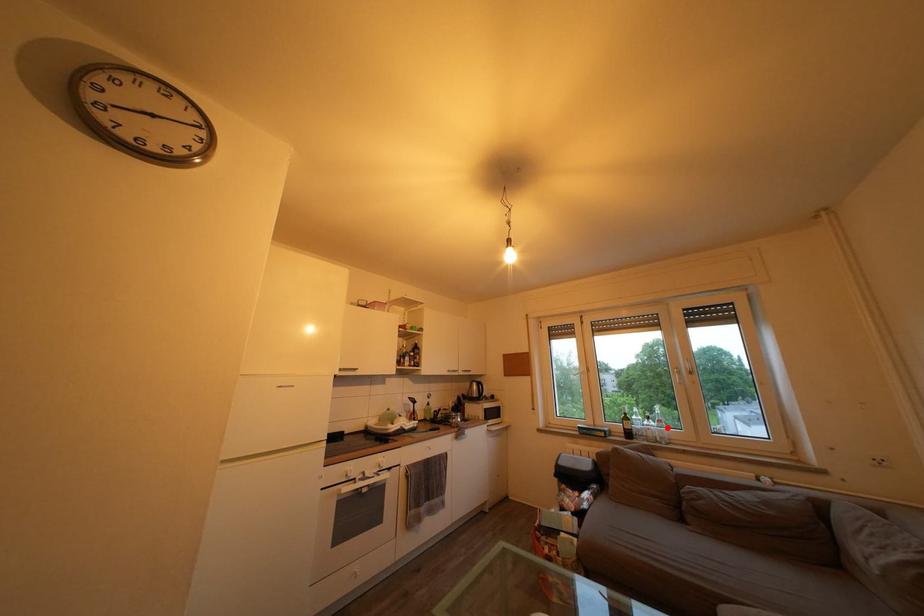
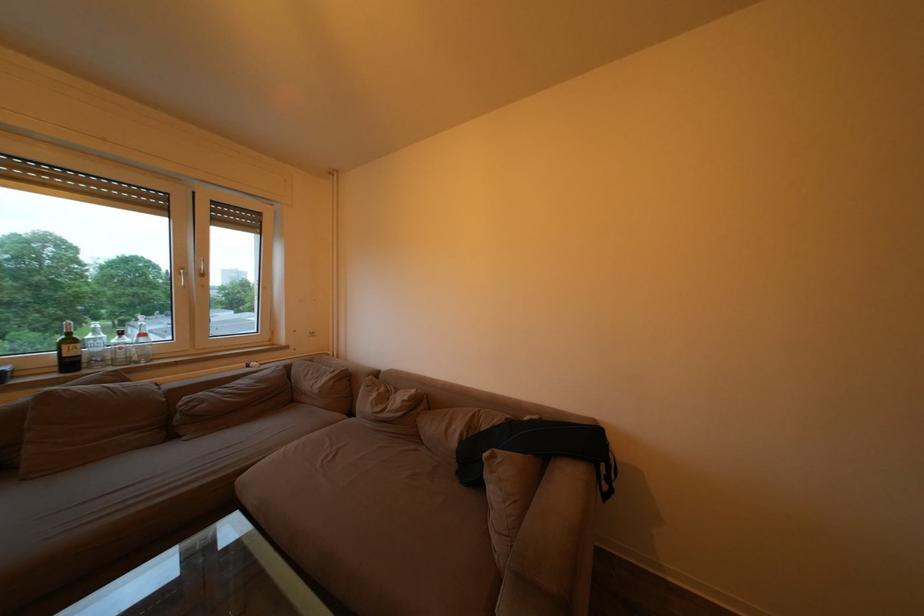
The point at the highlighted location is marked in the first image. Where is the corresponding point in the second image?

(151, 341)